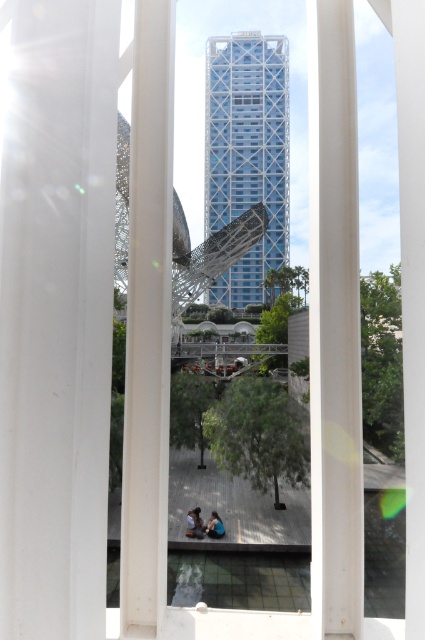
Is white matte pillar at center further to the viewer compared to white smooth pillar at left?

Yes.

Between white matte pillar at center and white smooth pillar at left, which one is positioned lower?

white matte pillar at center is lower down.

Which is in front, point (345, 432) or point (155, 480)?

Point (345, 432)

Where is `white matte pillar at center`? This screenshot has width=425, height=640. white matte pillar at center is located at coordinates (334, 326).

Is blue denim jeans at lower center shorter than blue fabric person at lower center?

In fact, blue denim jeans at lower center may be taller than blue fabric person at lower center.

Is point (197, 528) farther from camera compared to point (217, 531)?

Yes, point (197, 528) is farther from viewer.

Between point (197, 518) and point (223, 524), which one is positioned in front?

Positioned in front is point (197, 518).

Where is `blue denim jeans at lower center`? The image size is (425, 640). blue denim jeans at lower center is located at coordinates (195, 524).

Is white matte pillar at center shorter than blue fabric person at lower center?

In fact, white matte pillar at center may be taller than blue fabric person at lower center.

Locate an element on the screen. This screenshot has width=425, height=640. white matte pillar at center is located at coordinates (334, 326).